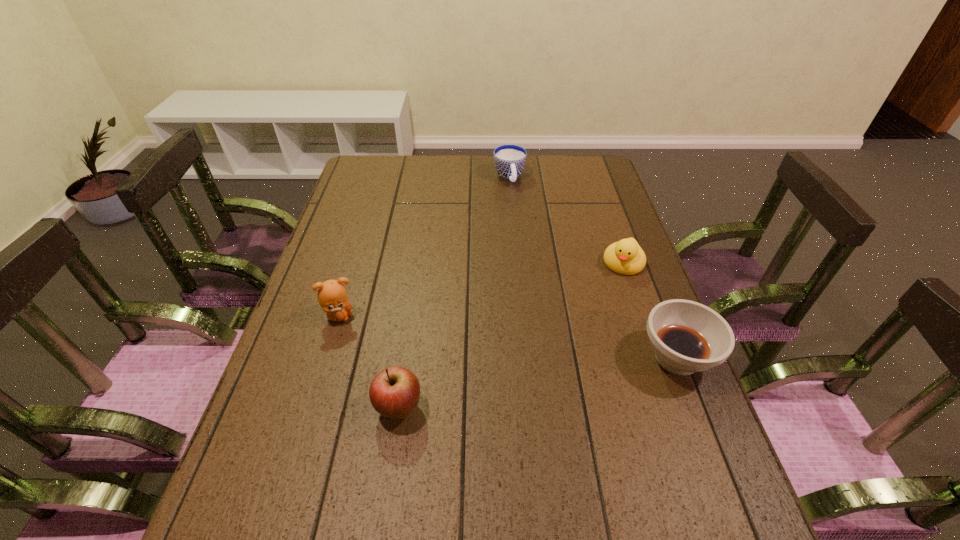
This screenshot has height=540, width=960. In order to click on soup bowl that is at the right edge in this screenshot , I will do `click(686, 337)`.

This screenshot has width=960, height=540. I want to click on duckling positioned at the right edge, so click(626, 257).

Identify the location of vacant space at the far edge of the desktop. (428, 169).

Where is `free region at the near edge`? Image resolution: width=960 pixels, height=540 pixels. free region at the near edge is located at coordinates (612, 477).

Where is `vacant space at the left edge`? vacant space at the left edge is located at coordinates (290, 441).

In the image, there is a desktop. What are the coordinates of `vacant region at the right edge` in the screenshot? It's located at (638, 423).

This screenshot has height=540, width=960. Identify the location of vacant space at the far right corner of the desktop. (588, 180).

Image resolution: width=960 pixels, height=540 pixels. In order to click on free space that is in between the duckling and the soup bowl in this screenshot , I will do `click(650, 310)`.

The width and height of the screenshot is (960, 540). Identify the location of vacant area that lies between the soup bowl and the duckling. (650, 310).

The width and height of the screenshot is (960, 540). In order to click on vacant area between the leftmost object and the apple in this screenshot , I will do `click(370, 362)`.